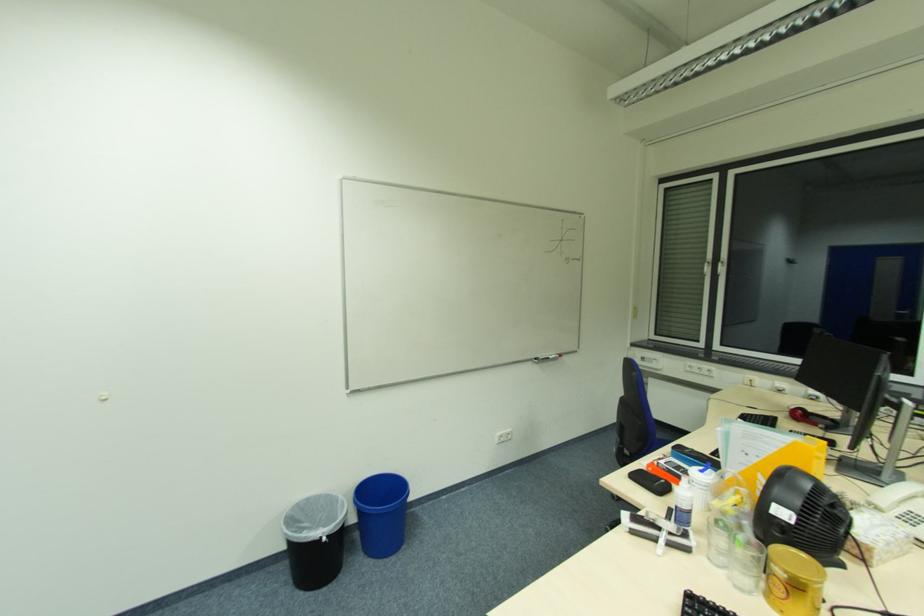
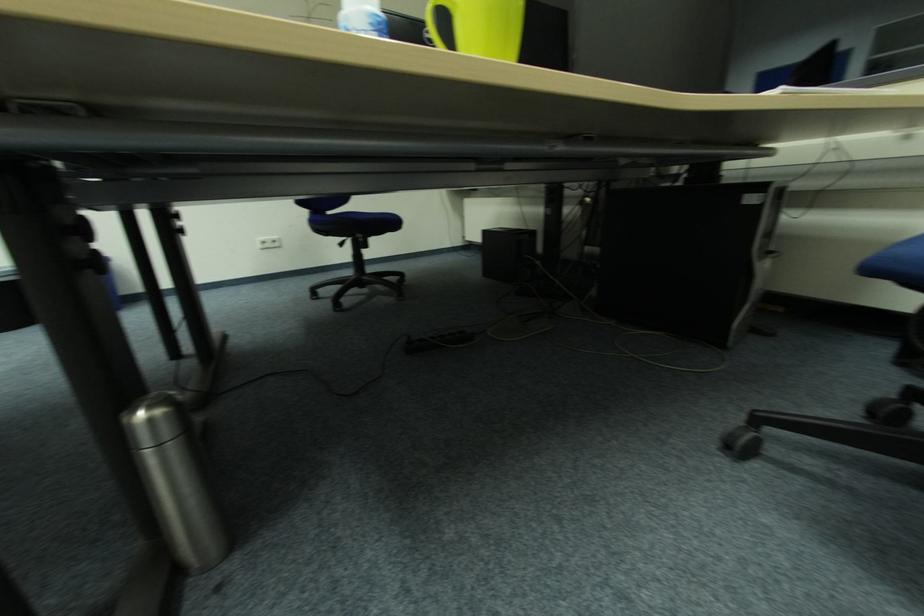
Question: Which direction would the cameraman need to move to produce the second image? Reply with the corresponding letter.

Choices:
 (A) Left
 (B) Right
 (C) Forward
 (D) Backward

Answer: (B)